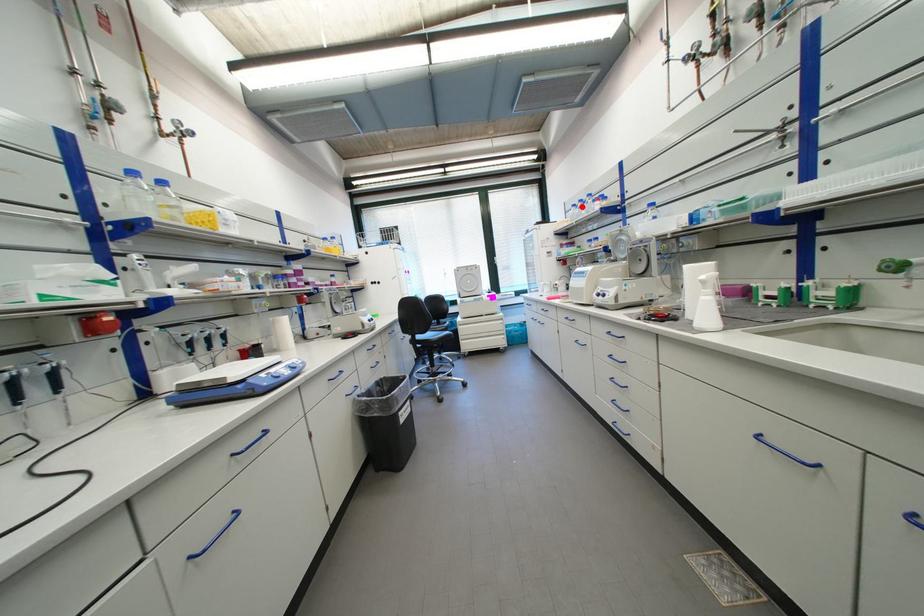
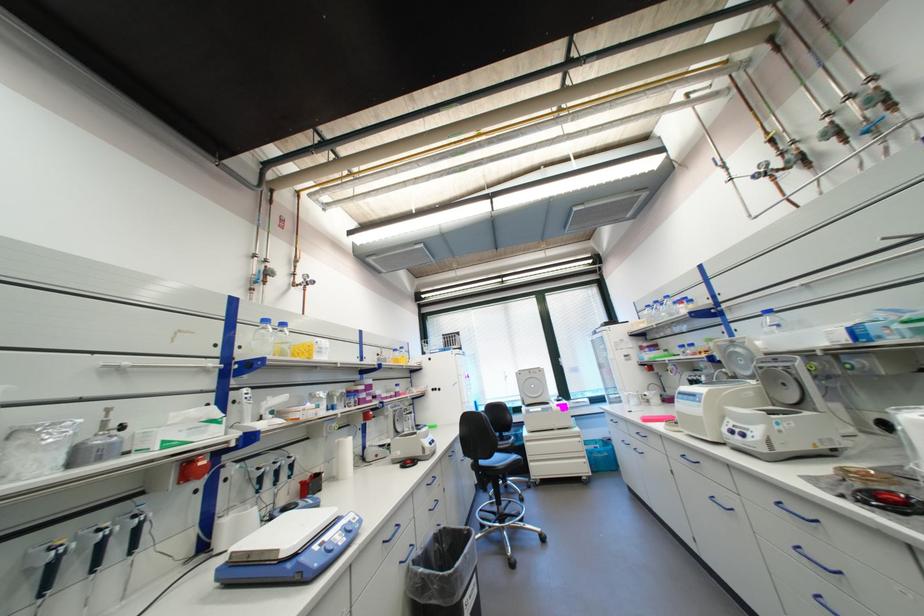
Question: I am providing you with two images of the same scene from different viewpoints. In image1, a red point is highlighted. Considering the same 3D point in image2, which of the following is correct?

Choices:
 (A) It is closer
 (B) It is farther

Answer: (B)